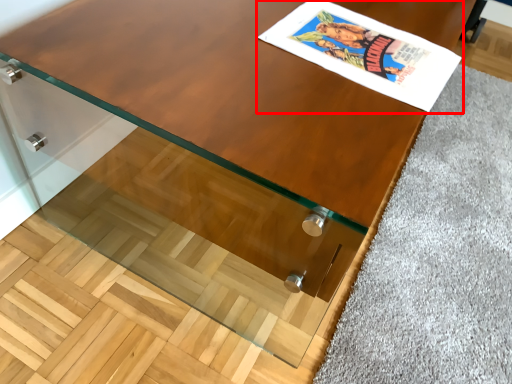
Question: In this image, where is comic book (annotated by the red box) located relative to gray?

Choices:
 (A) left
 (B) right

Answer: (A)